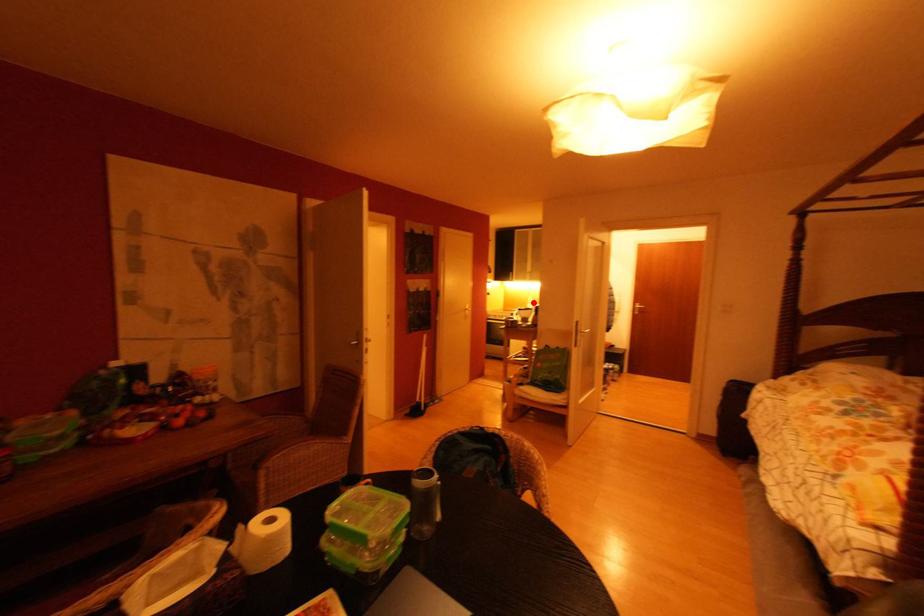
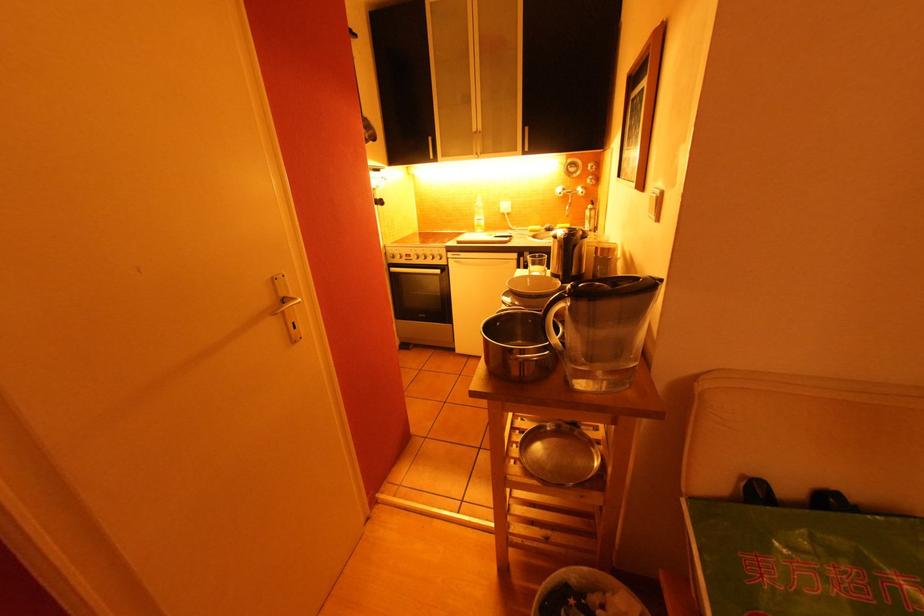
Where in the second image is the point corresponding to the highlighted location from the first image?

(481, 211)